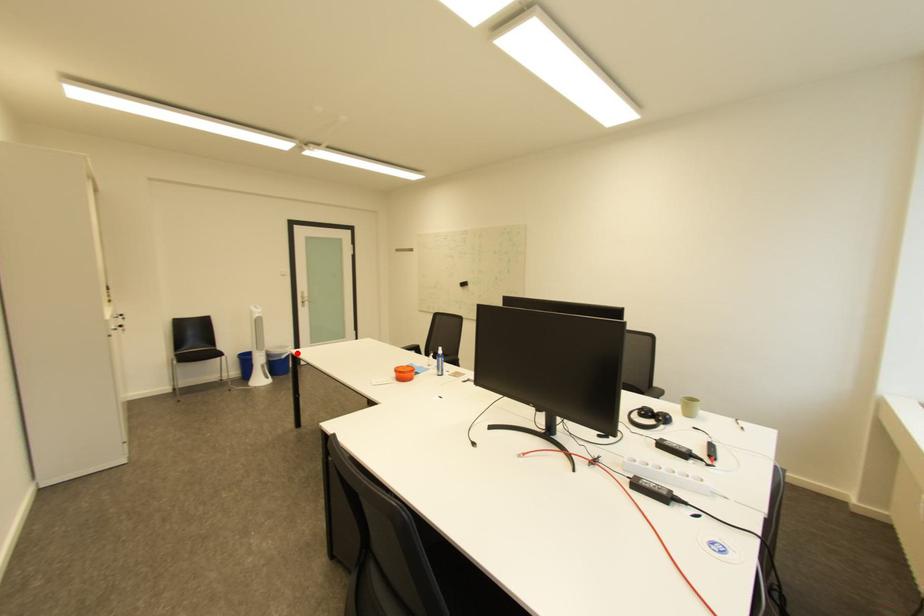
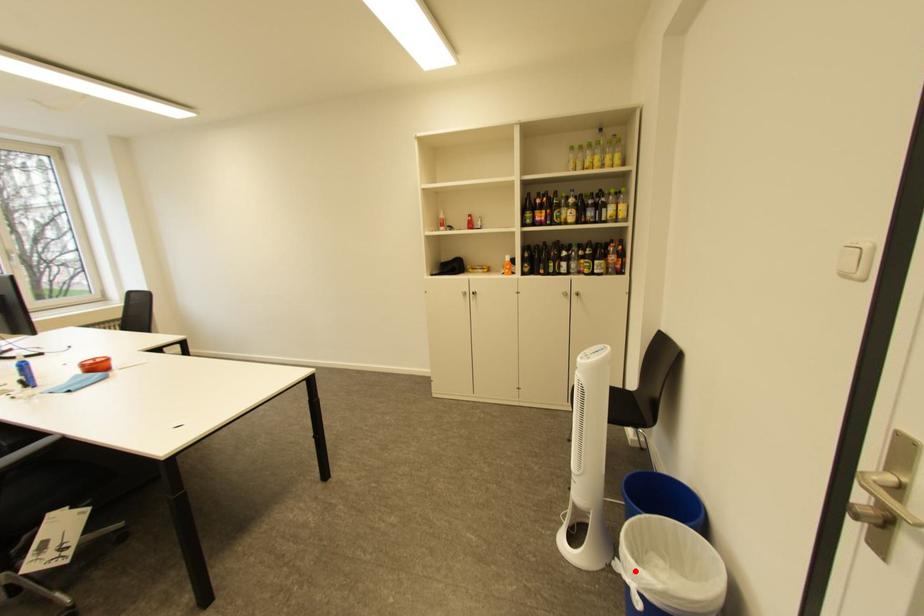
I am providing you with two images of the same scene from different viewpoints. A red point is marked on the first image and another point is marked on the second image. Do the highlighted points in image1 and image2 indicate the same real-world spot?

Yes